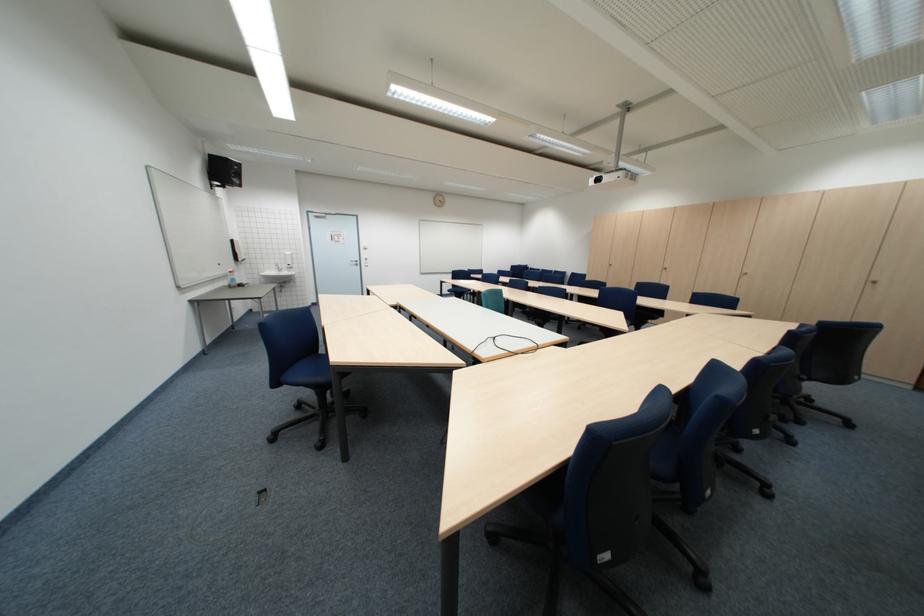
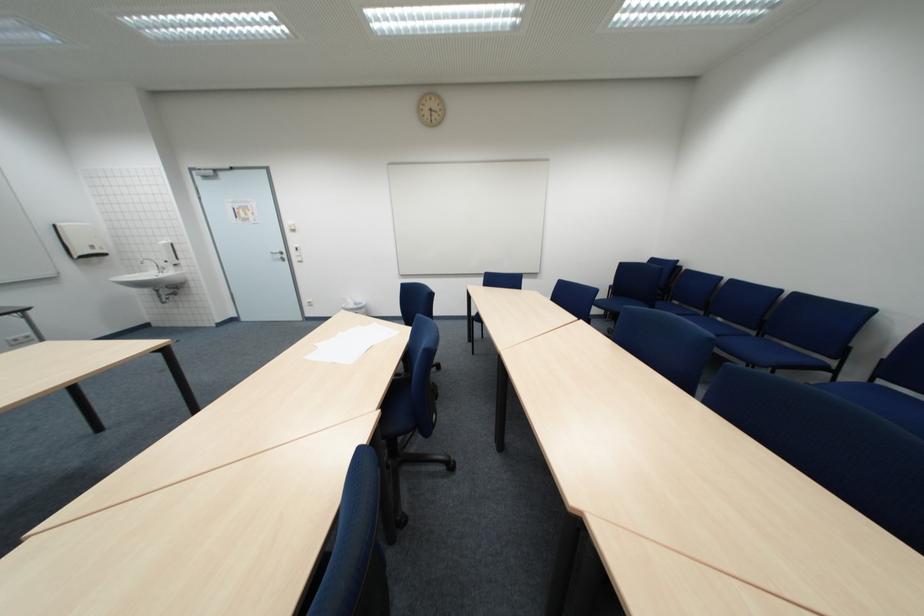
Where in the second image is the point corresponding to point (371, 265) from the first image?

(299, 257)